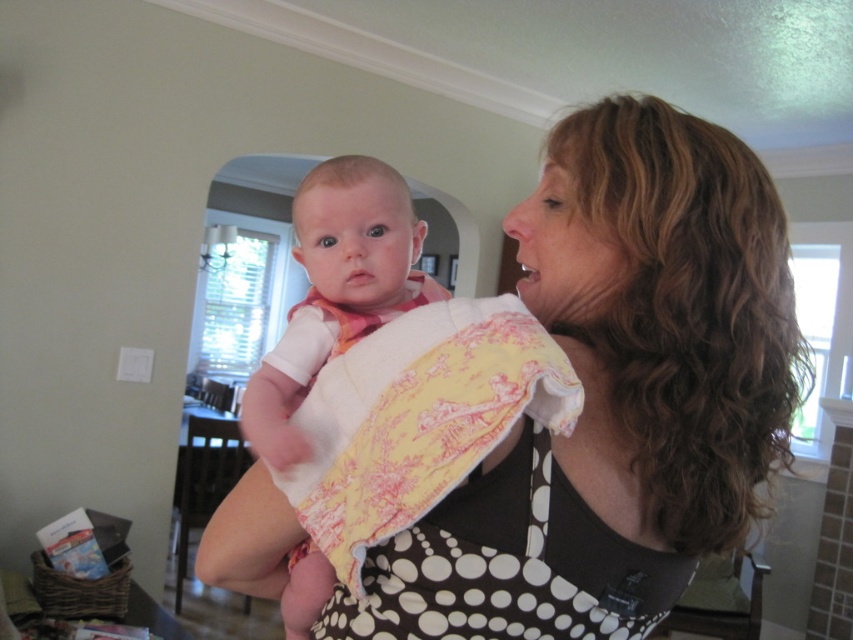
Question: Which of the following is the farthest from the observer?

Choices:
 (A) yellow printed fabric at center
 (B) soft yellow fabric baby at center
 (C) polka dot fabric at center

Answer: (B)

Question: Which object is the closest to the soft yellow fabric baby at center?

Choices:
 (A) polka dot fabric at center
 (B) yellow printed fabric at center

Answer: (A)

Question: Based on their relative distances, which object is nearer to the polka dot fabric at center?

Choices:
 (A) yellow printed fabric at center
 (B) soft yellow fabric baby at center

Answer: (A)

Question: Is yellow printed fabric at center bigger than soft yellow fabric baby at center?

Choices:
 (A) yes
 (B) no

Answer: (B)

Question: Can you confirm if yellow printed fabric at center is thinner than soft yellow fabric baby at center?

Choices:
 (A) yes
 (B) no

Answer: (B)

Question: Does polka dot fabric at center have a smaller size compared to soft yellow fabric baby at center?

Choices:
 (A) yes
 (B) no

Answer: (B)